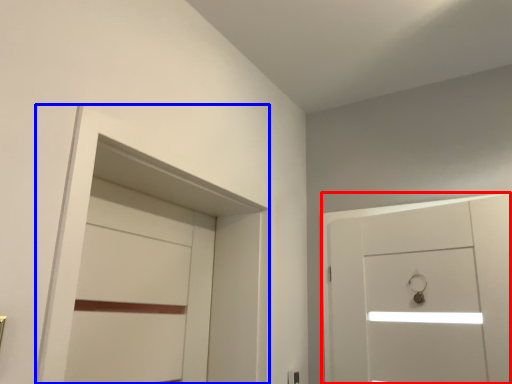
Question: Which object appears closest to the camera in this image, door (highlighted by a red box) or locker (highlighted by a blue box)?

Choices:
 (A) door
 (B) locker

Answer: (B)